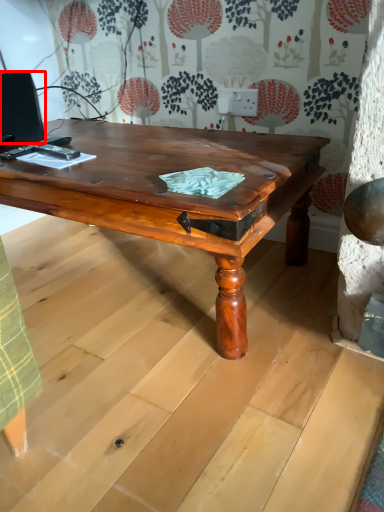
Question: Considering the relative positions of computer monitor (annotated by the red box) and coffee table in the image provided, where is computer monitor (annotated by the red box) located with respect to the staircase?

Choices:
 (A) right
 (B) left

Answer: (B)